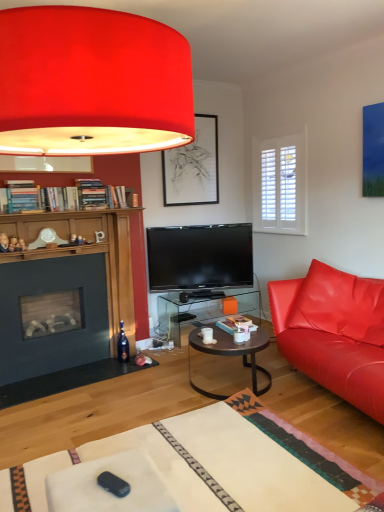
Question: In terms of size, does black plastic remote control at lower center appear bigger or smaller than matte leather couch at right?

Choices:
 (A) big
 (B) small

Answer: (B)

Question: Considering the positions of point tap(109, 472) and point tap(357, 336), is point tap(109, 472) closer or farther from the camera than point tap(357, 336)?

Choices:
 (A) farther
 (B) closer

Answer: (B)

Question: Which object is the farthest from the translucent glass table at center?

Choices:
 (A) matte black picture frame at upper center
 (B) metallic dark brown coffee table at center
 (C) matte leather couch at right
 (D) matte red lampshade at upper center
 (E) white glossy coffee cup at center

Answer: (D)

Question: Based on their relative distances, which object is nearer to the black plastic remote control at lower center?

Choices:
 (A) metallic dark brown coffee table at center
 (B) translucent glass table at center
 (C) matte black picture frame at upper center
 (D) matte red lampshade at upper center
 (E) matte leather couch at right

Answer: (D)